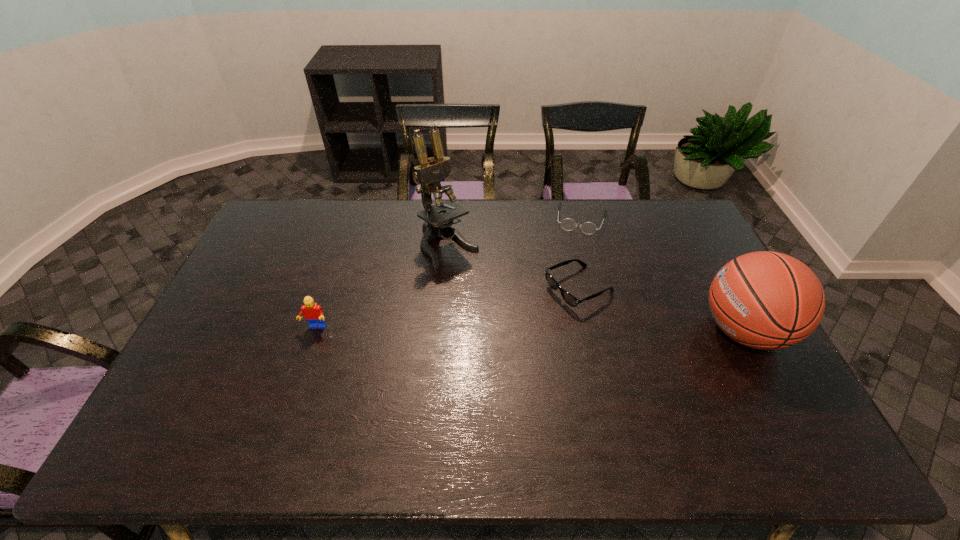
This screenshot has height=540, width=960. Find the location of `free space at the near left corner`. free space at the near left corner is located at coordinates (233, 392).

The width and height of the screenshot is (960, 540). Identify the location of free space between the rightmost object and the shortest object. (662, 275).

At what (x,y) coordinates should I click in order to perform the action: click on vacant area that lies between the microscope and the shortest object. Please return your answer as a coordinate pair (x, y). Looking at the image, I should click on (516, 233).

Identify the location of free space that is in between the nearer spectacles and the rightmost object. (661, 310).

Locate an element on the screen. This screenshot has width=960, height=540. vacant region between the nearer spectacles and the Lego is located at coordinates (447, 308).

Identify the location of vacant area that lies between the fourth object from right to left and the shortest object. This screenshot has height=540, width=960. (516, 233).

Where is `vacant space that's between the nearer spectacles and the microscope`? The width and height of the screenshot is (960, 540). vacant space that's between the nearer spectacles and the microscope is located at coordinates pyautogui.click(x=514, y=268).

Where is `unoccupied area between the microscope and the shorter spectacles`? The height and width of the screenshot is (540, 960). unoccupied area between the microscope and the shorter spectacles is located at coordinates point(516,233).

In order to click on free point between the microscope and the shortest object in this screenshot , I will do `click(516, 233)`.

I want to click on vacant point located between the leftmost object and the nearer spectacles, so click(447, 308).